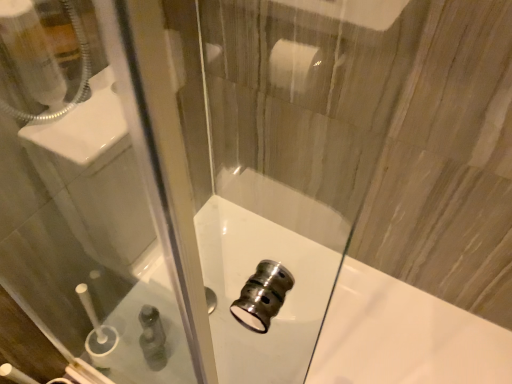
Where is `polished chrome faucet at center`? The width and height of the screenshot is (512, 384). polished chrome faucet at center is located at coordinates (404, 336).

Describe the element at coordinates (404, 336) in the screenshot. I see `polished chrome faucet at center` at that location.

What do you see at coordinates (152, 338) in the screenshot? The image size is (512, 384). I see `green plastic bottle at lower left` at bounding box center [152, 338].

At what (x,y) coordinates should I click in order to perform the action: click on green plastic bottle at lower left. Please return your answer as a coordinate pair (x, y). This screenshot has width=512, height=384. Looking at the image, I should click on (152, 338).

What is the approximate height of green plastic bottle at lower left?

green plastic bottle at lower left is 8.20 inches tall.

Find the location of a particular element. The width and height of the screenshot is (512, 384). polished chrome faucet at center is located at coordinates (404, 336).

Considering the relative positions of polished chrome faucet at center and green plastic bottle at lower left in the image provided, is polished chrome faucet at center to the right of green plastic bottle at lower left from the viewer's perspective?

Correct, you'll find polished chrome faucet at center to the right of green plastic bottle at lower left.

Is the position of polished chrome faucet at center less distant than that of green plastic bottle at lower left?

That is True.

Does point (248, 267) come in front of point (159, 370)?

That is True.

From the image's perspective, who appears lower, polished chrome faucet at center or green plastic bottle at lower left?

polished chrome faucet at center appears lower in the image.

From a real-world perspective, which object rests below the other?

polished chrome faucet at center is physically lower.

Looking at their sizes, would you say polished chrome faucet at center is wider or thinner than green plastic bottle at lower left?

Considering their sizes, polished chrome faucet at center looks broader than green plastic bottle at lower left.

Is polished chrome faucet at center taller than green plastic bottle at lower left?

No.

Does polished chrome faucet at center have a smaller size compared to green plastic bottle at lower left?

Incorrect, polished chrome faucet at center is not smaller in size than green plastic bottle at lower left.

Is polished chrome faucet at center completely or partially outside of green plastic bottle at lower left?

Yes, polished chrome faucet at center is outside of green plastic bottle at lower left.

Is polished chrome faucet at center next to green plastic bottle at lower left and touching it?

No, polished chrome faucet at center is not making contact with green plastic bottle at lower left.

Could you tell me if polished chrome faucet at center is turned towards green plastic bottle at lower left?

No, polished chrome faucet at center is not aimed at green plastic bottle at lower left.

Can you tell me how much polished chrome faucet at center and green plastic bottle at lower left differ in facing direction?

polished chrome faucet at center and green plastic bottle at lower left are facing 88 degrees away from each other.

You are a GUI agent. You are given a task and a screenshot of the screen. Output one action in this format:
    pyautogui.click(x=<x>, y=<y>)
    Task: Click on the toiletry lying behind the polished chrome faucet at center
    
    Given the screenshot: What is the action you would take?
    pyautogui.click(x=152, y=338)

Is green plastic bottle at lower left to the left of polished chrome faucet at center from the viewer's perspective?

Yes.

From the picture: Does green plastic bottle at lower left come behind polished chrome faucet at center?

Yes, it is.

Which point is more distant from viewer, (158,330) or (495,350)?

The point (158,330) is behind.

From the image's perspective, does green plastic bottle at lower left appear higher than polished chrome faucet at center?

Indeed, from the image's perspective, green plastic bottle at lower left is shown above polished chrome faucet at center.

From a real-world perspective, which is physically below, green plastic bottle at lower left or polished chrome faucet at center?

polished chrome faucet at center is physically lower.

In terms of width, does green plastic bottle at lower left look wider or thinner when compared to polished chrome faucet at center?

Clearly, green plastic bottle at lower left has less width compared to polished chrome faucet at center.

Between green plastic bottle at lower left and polished chrome faucet at center, which one has less height?

With less height is polished chrome faucet at center.

In the scene shown: Is green plastic bottle at lower left bigger or smaller than polished chrome faucet at center?

Considering their sizes, green plastic bottle at lower left takes up less space than polished chrome faucet at center.

Is green plastic bottle at lower left inside or outside of polished chrome faucet at center?

green plastic bottle at lower left is outside polished chrome faucet at center.

Is there a large distance between green plastic bottle at lower left and polished chrome faucet at center?

Actually, green plastic bottle at lower left and polished chrome faucet at center are a little close together.

Is polished chrome faucet at center at the back of green plastic bottle at lower left?

That's not correct — green plastic bottle at lower left is not looking away from polished chrome faucet at center.

Can you tell me how much green plastic bottle at lower left and polished chrome faucet at center differ in facing direction?

green plastic bottle at lower left and polished chrome faucet at center are facing 88 degrees away from each other.

Image resolution: width=512 pixels, height=384 pixels. I want to click on toiletry behind the polished chrome faucet at center, so click(x=152, y=338).

Where is `toiletry lying on the left of polished chrome faucet at center`? toiletry lying on the left of polished chrome faucet at center is located at coordinates (152, 338).

Locate an element on the screen. This screenshot has width=512, height=384. toiletry behind the polished chrome faucet at center is located at coordinates click(152, 338).